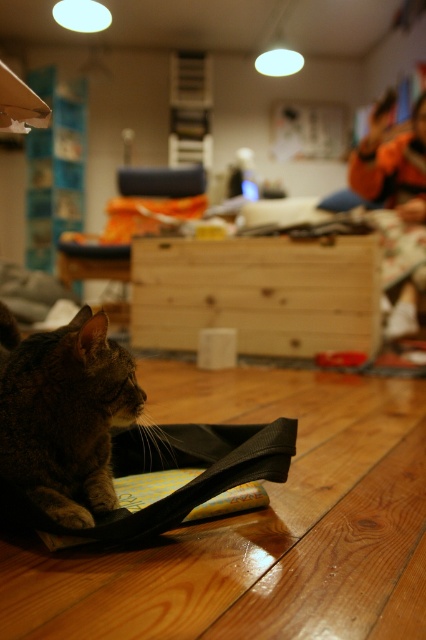
You are standing in the living room and want to place a small plant between the two points, point [302,257] and point [94,404]. Which point is closer to you so that the plant can be placed in between them?

Point [302,257] is further to the camera than point [94,404], so the closer point to you is point [94,404]. Therefore, you should place the plant between point [302,257] and point [94,404] with point [94,404] being closer to you.

What is the location of the point with coordinates (258,292) in the scene?

The point with coordinates (258,292) is located on the natural wood drawer at center.